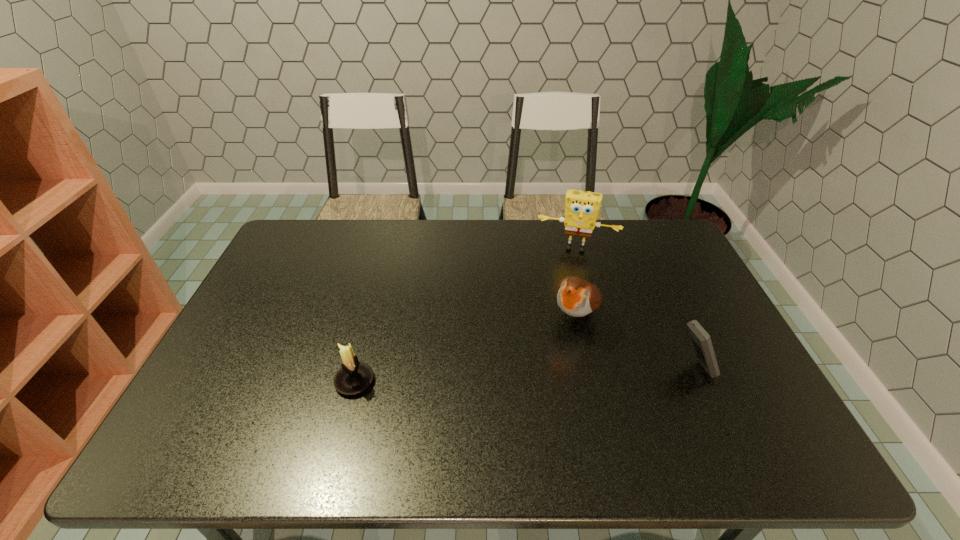
Where is `the leftmost object`? the leftmost object is located at coordinates (354, 377).

Where is `the rightmost object`? the rightmost object is located at coordinates (701, 339).

You are a GUI agent. You are given a task and a screenshot of the screen. Output one action in this format:
    pyautogui.click(x=<x>, y=<y>)
    Task: Click on the farthest object
    
    Given the screenshot: What is the action you would take?
    pyautogui.click(x=582, y=208)

At what (x,y) coordinates should I click in order to perform the action: click on the second farthest object. Please return your answer as a coordinate pair (x, y). This screenshot has height=540, width=960. Looking at the image, I should click on (576, 297).

Identify the location of vacant space located 0.190m on the right of the leftmost object. The image size is (960, 540). (449, 381).

Locate an element on the screen. Image resolution: width=960 pixels, height=540 pixels. free space located 0.080m on the front-facing side of the rightmost object is located at coordinates (742, 368).

Locate an element on the screen. This screenshot has width=960, height=540. free space located on the face of the sponge is located at coordinates (564, 277).

Image resolution: width=960 pixels, height=540 pixels. I want to click on free location located 0.160m on the face of the sponge, so click(564, 287).

Find the location of a particular element. Image resolution: width=960 pixels, height=540 pixels. vacant space located 0.100m on the face of the sponge is located at coordinates (565, 275).

Where is `vacant region located 0.090m at the face of the second farthest object`? vacant region located 0.090m at the face of the second farthest object is located at coordinates (553, 359).